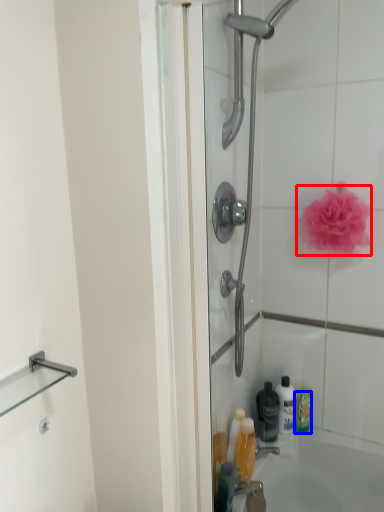
Question: Which object is further to the camera taking this photo, rose (highlighted by a red box) or cleaning product (highlighted by a blue box)?

Choices:
 (A) rose
 (B) cleaning product

Answer: (B)